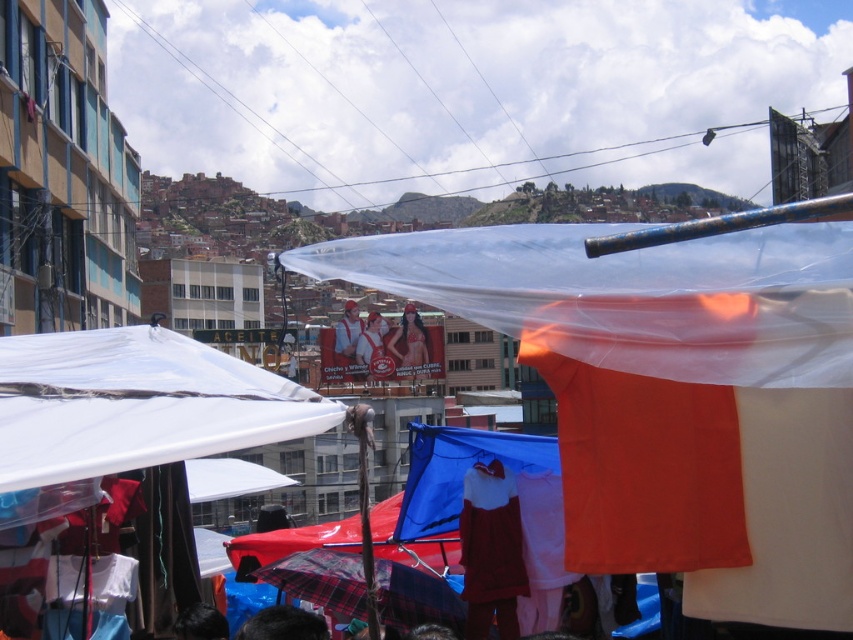
You are a vendor at the market and want to cover your stall with a transparent plastic canopy at center. Your current canopy is the matte red shirt at center. Can the new canopy cover the same area as the current one?

The transparent plastic canopy at center has a larger width than the matte red shirt at center, so it can cover a larger area and would be sufficient to cover the stall.

You are a customer at the market and want to take a photo of the plaid fabric umbrella at center and the matte red shirt at center. Which object should you focus on first if you want to capture both in the same frame without moving the camera?

The plaid fabric umbrella at center is much taller than the matte red shirt at center, so you should focus on the plaid fabric umbrella at center first to ensure it fits within the frame.

You are a photographer trying to capture the vibrant market scene. You want to position yourself so that both the white matte canopy at upper left and the blue fabric canopy at center are visible in your shot. Based on their positions, which canopy should you place on the left side of your camera frame?

The white matte canopy at upper left is to the left of the blue fabric canopy at center, so you should position the white matte canopy at upper left on the left side of your camera frame to include both in the shot.